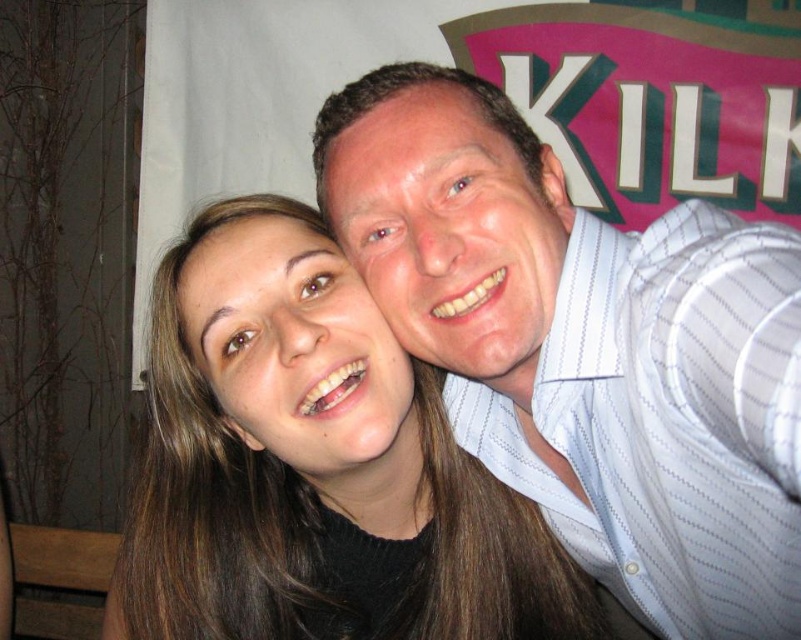
You are a photographer trying to adjust the lighting for a group photo. You notice the white striped shirt at upper right and the brown hair at center. Which object should you focus on to ensure proper exposure since it takes up more space in the frame?

The brown hair at center takes up more space in the frame than the white striped shirt at upper right, so you should focus on the brown hair at center for proper exposure.

You are taking a photo of two friends. You need to ensure that the white striped shirt at upper right and the brown hair at center are both visible in the frame. Based on their sizes, which one will occupy more vertical space in the photo?

The white striped shirt at upper right has a greater height compared to the brown hair at center, so it will occupy more vertical space in the photo.

You are taking a selfie with two friends. You notice a point at coordinates (586, 346). Which object from the scene is located at that point?

The white striped shirt at upper right is located at point (586, 346).